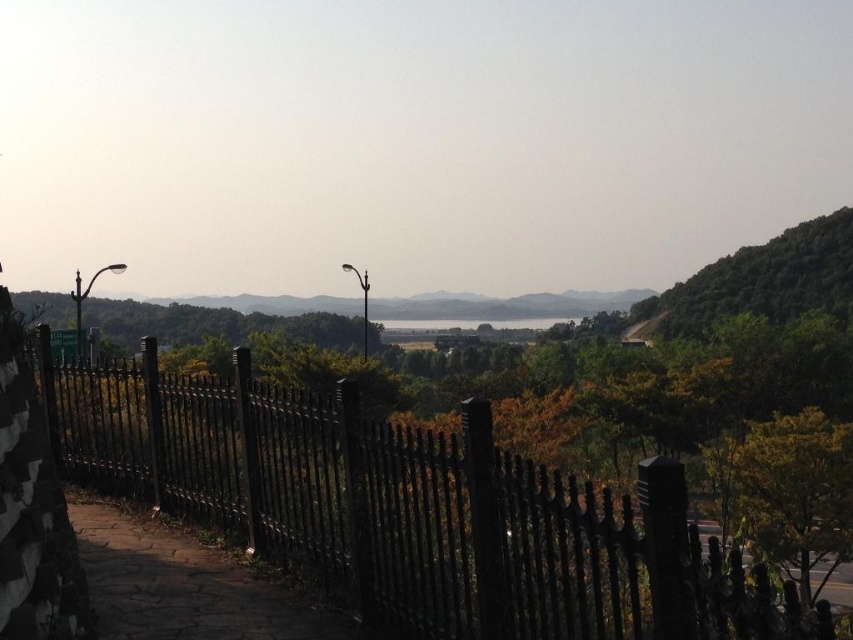
Question: Is black wrought iron fence at center positioned before brown stone path at lower left?

Choices:
 (A) no
 (B) yes

Answer: (B)

Question: Does black wrought iron fence at center appear over brown stone path at lower left?

Choices:
 (A) no
 (B) yes

Answer: (A)

Question: Does black wrought iron fence at center have a smaller size compared to brown stone path at lower left?

Choices:
 (A) yes
 (B) no

Answer: (B)